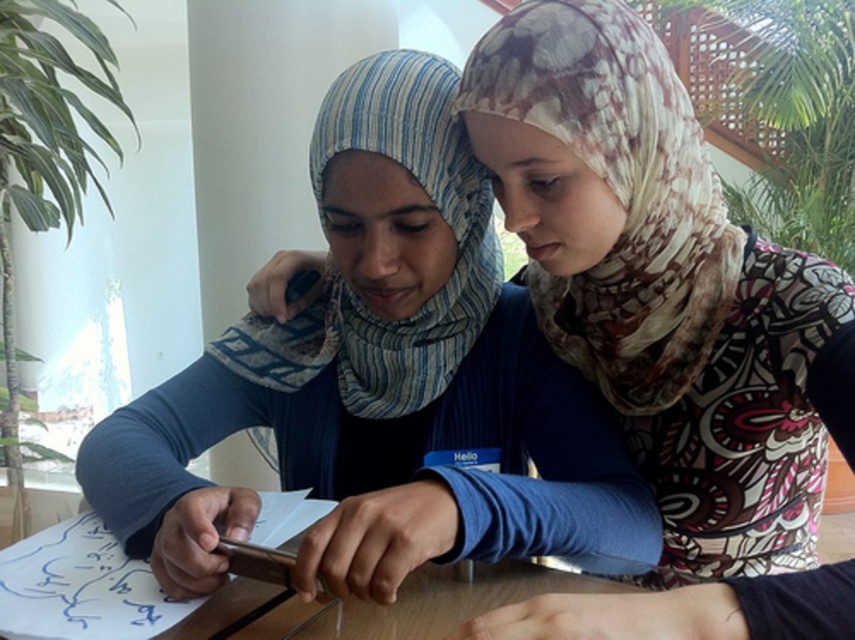
Does point (447, 328) come in front of point (411, 83)?

That is False.

Is point (375, 236) closer to viewer compared to point (373, 129)?

No, (375, 236) is further to viewer.

The width and height of the screenshot is (855, 640). In order to click on blue fabric shirt at center in this screenshot , I will do `click(381, 381)`.

Measure the distance between blue fabric shirt at center and printed silk scarf at upper right.

blue fabric shirt at center and printed silk scarf at upper right are 6.87 inches apart from each other.

Locate an element on the screen. Image resolution: width=855 pixels, height=640 pixels. blue fabric shirt at center is located at coordinates (381, 381).

Who is more forward, (426, 76) or (500, 102)?

Positioned in front is point (500, 102).

The width and height of the screenshot is (855, 640). I want to click on blue fabric shirt at center, so click(381, 381).

Is point (565, 76) positioned in front of point (258, 353)?

Yes, it is.

Does printed silk scarf at upper right appear over blue striped scarf at center?

Yes, printed silk scarf at upper right is above blue striped scarf at center.

Is point (680, 108) in front of point (481, 196)?

Yes, it is in front of point (481, 196).

Identify the location of printed silk scarf at upper right. (618, 193).